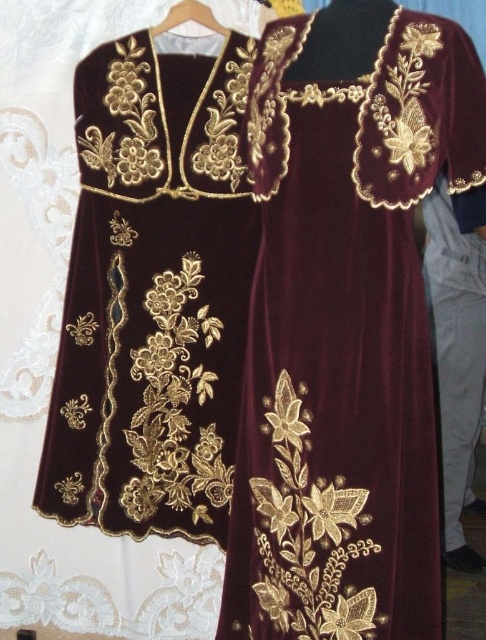
Which is in front, point (212, 58) or point (190, 0)?

Point (190, 0) is more forward.

Is point (145, 336) farther from viewer compared to point (208, 20)?

Yes, point (145, 336) is behind point (208, 20).

Find the location of `velvet gold embroidered dress at center`. velvet gold embroidered dress at center is located at coordinates (154, 294).

Consider the image. Does velvet burgundy dress at center appear over velvet gold embroidered dress at center?

No, velvet burgundy dress at center is not above velvet gold embroidered dress at center.

Does velvet burgundy dress at center appear under velvet gold embroidered dress at center?

Correct, velvet burgundy dress at center is located below velvet gold embroidered dress at center.

This screenshot has height=640, width=486. I want to click on velvet burgundy dress at center, so click(345, 324).

Where is `velvet burgundy dress at center`? The width and height of the screenshot is (486, 640). velvet burgundy dress at center is located at coordinates [345, 324].

Is velvet burgundy dress at center closer to camera compared to wooden hanger at upper center?

That is True.

Is point (429, 579) positioned behind point (181, 22)?

No.

Find the location of `velvet burgundy dress at center`. velvet burgundy dress at center is located at coordinates (345, 324).